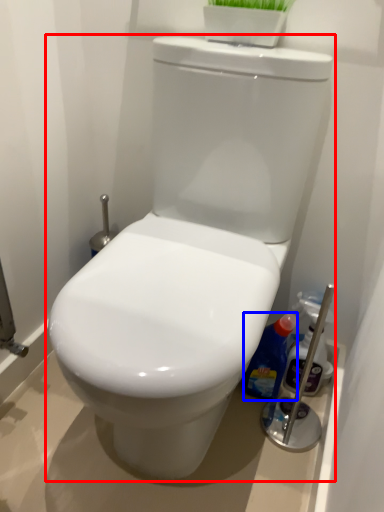
Question: Which object appears farthest to the camera in this image, toilet (highlighted by a red box) or cleaning product (highlighted by a blue box)?

Choices:
 (A) toilet
 (B) cleaning product

Answer: (B)